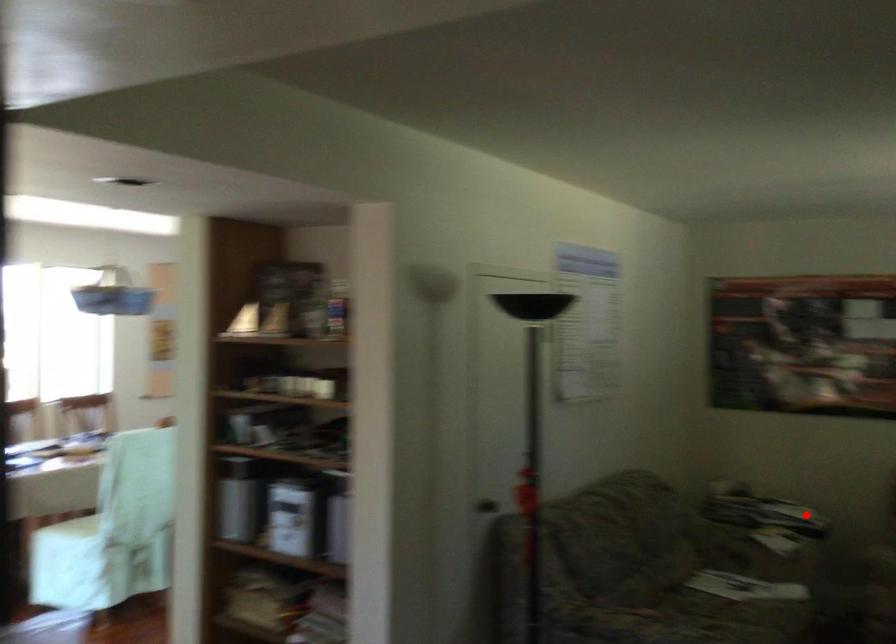
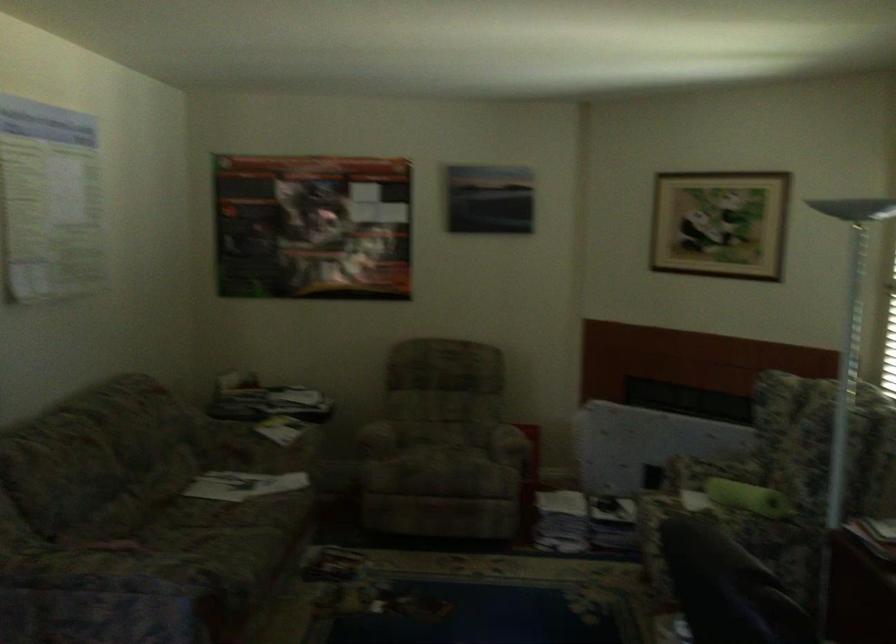
The point at the highlighted location is marked in the first image. Where is the corresponding point in the second image?

(377, 438)